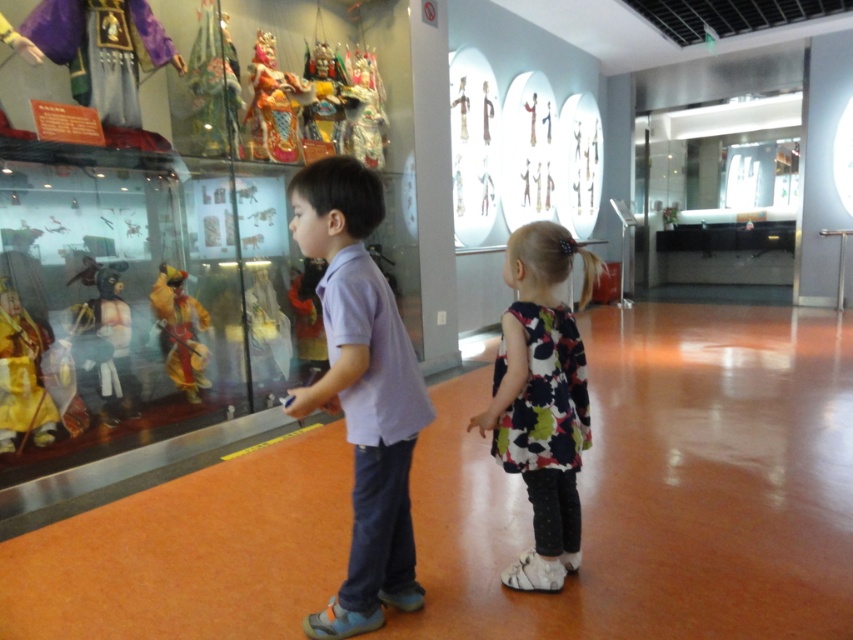
Is purple cotton shirt at center behind floral fabric dress at center?

No, it is not.

Can you confirm if purple cotton shirt at center is positioned below floral fabric dress at center?

Actually, purple cotton shirt at center is above floral fabric dress at center.

Is point (367, 449) closer to viewer compared to point (573, 371)?

Yes, it is in front of point (573, 371).

This screenshot has width=853, height=640. Find the location of `purple cotton shirt at center`. purple cotton shirt at center is located at coordinates (361, 392).

Can you confirm if silk puppet at upper center is positioned to the right of yellow fabric puppet at left?

Yes, silk puppet at upper center is to the right of yellow fabric puppet at left.

Is silk puppet at upper center to the left of yellow fabric puppet at left from the viewer's perspective?

In fact, silk puppet at upper center is to the right of yellow fabric puppet at left.

The width and height of the screenshot is (853, 640). In order to click on silk puppet at upper center in this screenshot , I will do `click(213, 86)`.

Can you confirm if matte black mask at left is positioned below yellow fabric puppet at left?

Correct, matte black mask at left is located below yellow fabric puppet at left.

From the picture: Which is more to the left, matte black mask at left or yellow fabric puppet at left?

matte black mask at left

Does point (109, 348) come behind point (183, 278)?

That is False.

The height and width of the screenshot is (640, 853). Find the location of `matte black mask at left`. matte black mask at left is located at coordinates [106, 339].